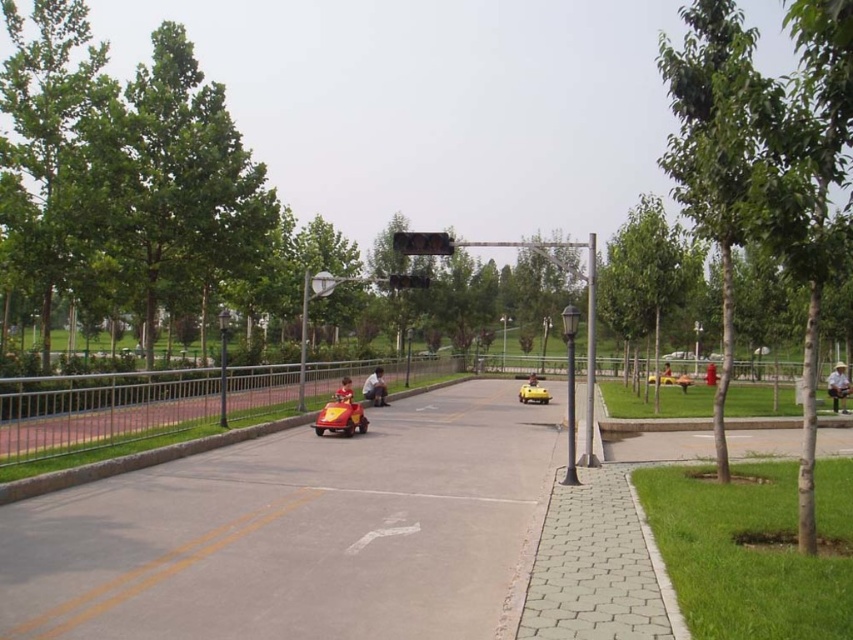
You are a parent watching your child play with the smooth red car at center in the park. The child is currently driving the car towards the metal railing on the left side of the road. If the distance between the child and the metal railing is 72.77 feet, is there enough space for the child to stop the car before reaching the railing?

The distance between the child and the metal railing is 72.77 feet, so yes, there is enough space for the child to stop the car before reaching the railing.

You are a parent watching your child play with the smooth red car at center. You want to ensure the car stays on the smooth concrete road at center. Based on the scene, is the car currently positioned to the left or right of the road?

The smooth red car at center is to the left of the smooth concrete road at center, so it is positioned to the left of the road.